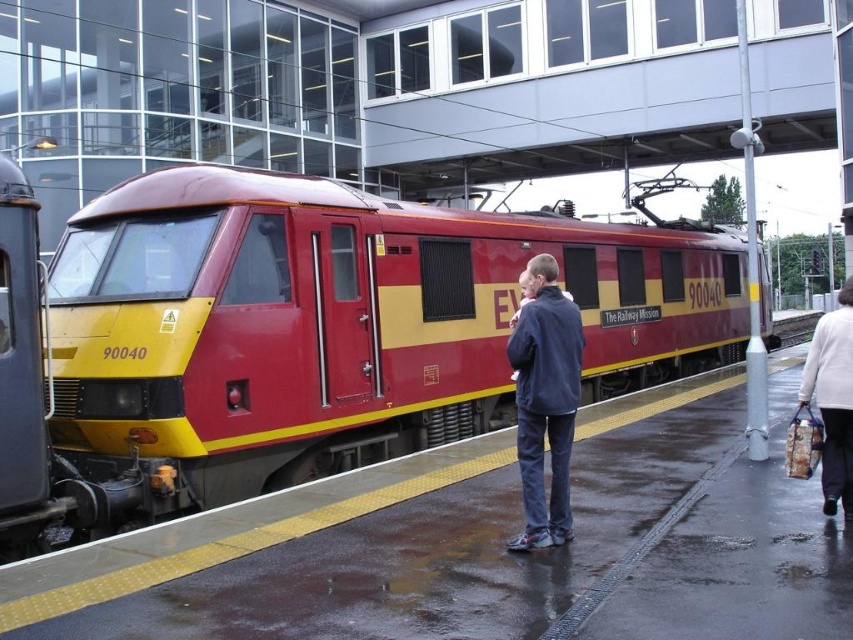
Question: Based on their relative distances, which object is farther from the matte red/yellow train at center?

Choices:
 (A) dark blue jacket at center
 (B) white sweater at lower right
 (C) yellow rubber platform at center

Answer: (A)

Question: Which point appears farthest from the camera in this image?

Choices:
 (A) (848, 481)
 (B) (199, 417)

Answer: (B)

Question: Does matte red/yellow train at center appear on the right side of yellow rubber platform at center?

Choices:
 (A) no
 (B) yes

Answer: (B)

Question: Can you confirm if matte red/yellow train at center is positioned below white sweater at lower right?

Choices:
 (A) yes
 (B) no

Answer: (B)

Question: Which object appears farthest from the camera in this image?

Choices:
 (A) dark blue jacket at center
 (B) white sweater at lower right
 (C) yellow rubber platform at center
 (D) matte red/yellow train at center

Answer: (B)

Question: Can you confirm if matte red/yellow train at center is positioned below dark blue jacket at center?

Choices:
 (A) yes
 (B) no

Answer: (B)